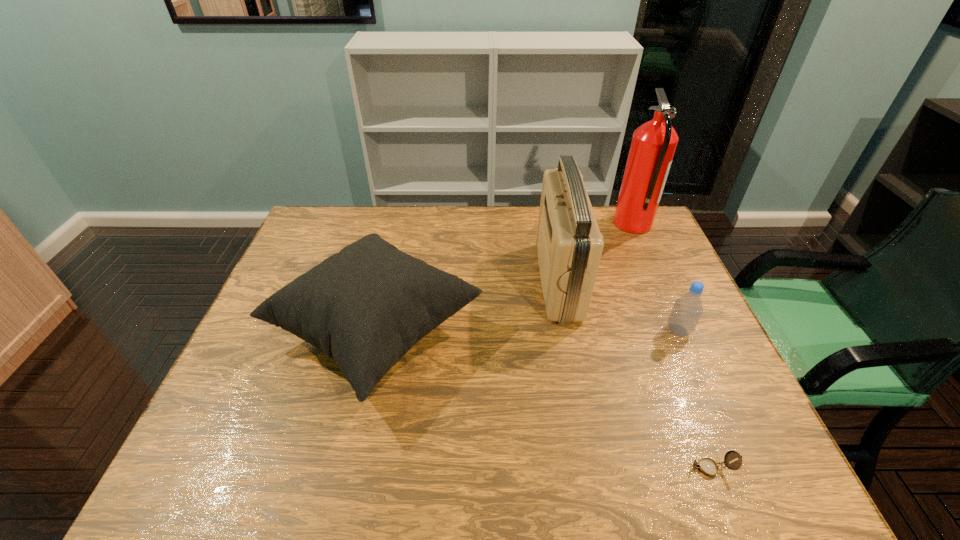
You are a GUI agent. You are given a task and a screenshot of the screen. Output one action in this format:
    pyautogui.click(x=<x>, y=<y>)
    Task: Click on the farthest object
    This screenshot has width=960, height=540.
    Given the screenshot: What is the action you would take?
    pyautogui.click(x=653, y=145)

This screenshot has height=540, width=960. I want to click on fire extinguisher, so click(653, 145).

The image size is (960, 540). I want to click on the fourth object from right to left, so click(x=569, y=243).

The width and height of the screenshot is (960, 540). Find the location of `radio receiver`. radio receiver is located at coordinates tap(569, 243).

This screenshot has height=540, width=960. I want to click on the leftmost object, so click(x=366, y=306).

I want to click on the third tallest object, so click(x=366, y=306).

At what (x,y) coordinates should I click in order to perform the action: click on the second shortest object. Please return your answer as a coordinate pair (x, y). This screenshot has width=960, height=540. Looking at the image, I should click on (687, 310).

The image size is (960, 540). What are the coordinates of `compass` in the screenshot? It's located at (707, 466).

The image size is (960, 540). I want to click on the nearest object, so click(x=707, y=466).

In order to click on vacant space located 0.270m at the nozzle of the tallest object in this screenshot , I will do [x=538, y=224].